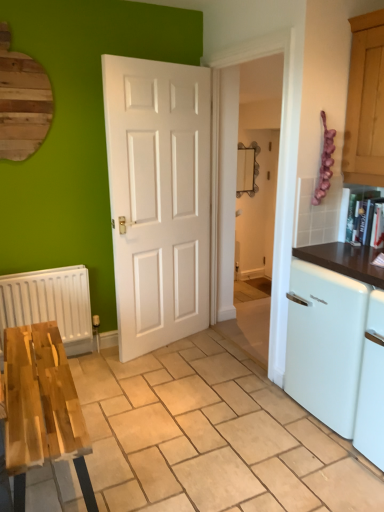
Question: Is white glossy dishwasher at right spatially inside white matte radiator at left, or outside of it?

Choices:
 (A) outside
 (B) inside

Answer: (A)

Question: Relative to white matte radiator at left, is white glossy dishwasher at right in front or behind?

Choices:
 (A) behind
 (B) front

Answer: (B)

Question: Which object is positioned closest to the white matte radiator at left?

Choices:
 (A) white glossy dishwasher at right
 (B) wooden table at lower left

Answer: (B)

Question: Which object is the farthest from the white glossy dishwasher at right?

Choices:
 (A) wooden table at lower left
 (B) white matte radiator at left

Answer: (B)